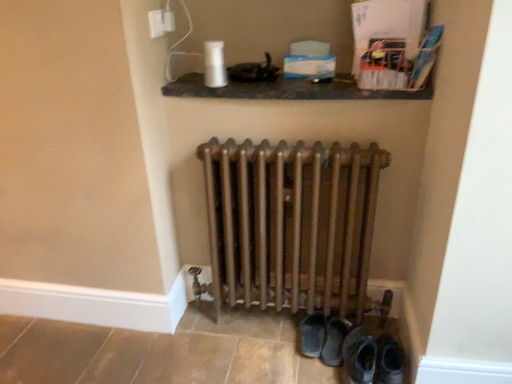
Question: Is dark brown leather shoes at lower center, positioned as the 2th footwear in right-to-left order, facing away from bronze metallic radiator at center?

Choices:
 (A) yes
 (B) no

Answer: (A)

Question: Considering the relative positions of dark brown leather shoes at lower center, which is the first footwear in left-to-right order, and bronze metallic radiator at center in the image provided, is dark brown leather shoes at lower center, which is the first footwear in left-to-right order, to the left of bronze metallic radiator at center from the viewer's perspective?

Choices:
 (A) no
 (B) yes

Answer: (A)

Question: From a real-world perspective, is dark brown leather shoes at lower center, which is the first footwear in left-to-right order, located higher than bronze metallic radiator at center?

Choices:
 (A) yes
 (B) no

Answer: (B)

Question: Does dark brown leather shoes at lower center, positioned as the 2th footwear in right-to-left order, have a lesser width compared to bronze metallic radiator at center?

Choices:
 (A) yes
 (B) no

Answer: (B)

Question: Is dark brown leather shoes at lower center, which is the first footwear in left-to-right order, aimed at bronze metallic radiator at center?

Choices:
 (A) no
 (B) yes

Answer: (A)

Question: Is white plastic electric outlet at upper center inside the boundaries of bronze metallic radiator at center, or outside?

Choices:
 (A) inside
 (B) outside

Answer: (B)

Question: Would you say white plastic electric outlet at upper center is to the left or to the right of bronze metallic radiator at center in the picture?

Choices:
 (A) left
 (B) right

Answer: (A)

Question: Based on their sizes in the image, would you say white plastic electric outlet at upper center is bigger or smaller than bronze metallic radiator at center?

Choices:
 (A) small
 (B) big

Answer: (A)

Question: Is white plastic electric outlet at upper center taller or shorter than bronze metallic radiator at center?

Choices:
 (A) short
 (B) tall

Answer: (A)

Question: Is dark brown leather shoes at lower center, positioned as the 2th footwear in right-to-left order, inside the boundaries of white plastic electric outlet at upper center, or outside?

Choices:
 (A) outside
 (B) inside

Answer: (A)

Question: Would you say dark brown leather shoes at lower center, which is the first footwear in left-to-right order, is to the left or to the right of white plastic electric outlet at upper center in the picture?

Choices:
 (A) left
 (B) right

Answer: (B)

Question: From the image's perspective, is dark brown leather shoes at lower center, positioned as the 2th footwear in right-to-left order, above or below white plastic electric outlet at upper center?

Choices:
 (A) below
 (B) above

Answer: (A)

Question: From a real-world perspective, is dark brown leather shoes at lower center, which is the first footwear in left-to-right order, physically located above or below white plastic electric outlet at upper center?

Choices:
 (A) above
 (B) below

Answer: (B)

Question: In terms of size, does matte black shelf at upper center appear bigger or smaller than bronze metallic radiator at center?

Choices:
 (A) big
 (B) small

Answer: (B)

Question: From the image's perspective, is matte black shelf at upper center above or below bronze metallic radiator at center?

Choices:
 (A) below
 (B) above

Answer: (B)